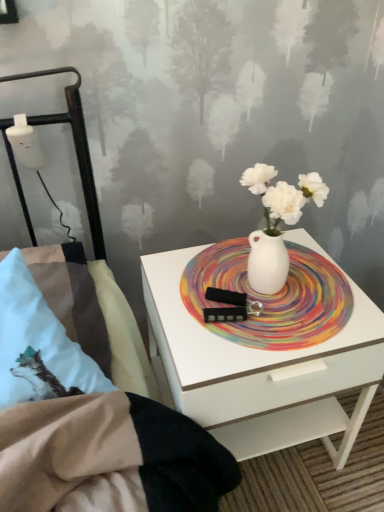
This screenshot has width=384, height=512. In order to click on free space above rainbow painted platter at center (from a real-world perspective) in this screenshot , I will do `click(257, 288)`.